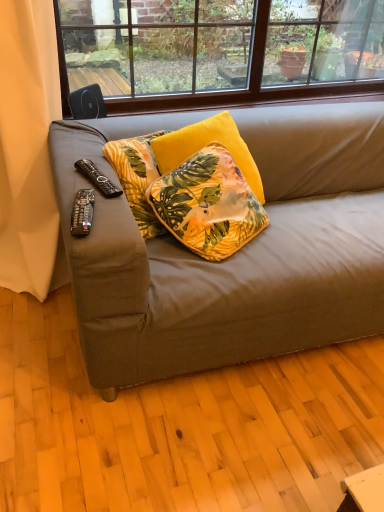
The image size is (384, 512). In order to click on unoccupied region to the right of black plastic remote control at lower left, which is counted as the second remote control, starting from the top in this screenshot , I will do coord(116,219).